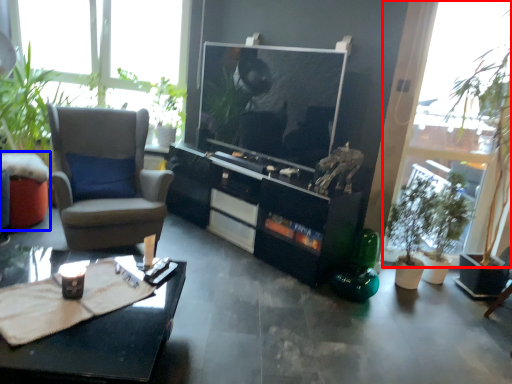
Question: Which point is further to the camera, window (highlighted by a red box) or table (highlighted by a blue box)?

Choices:
 (A) window
 (B) table

Answer: (B)